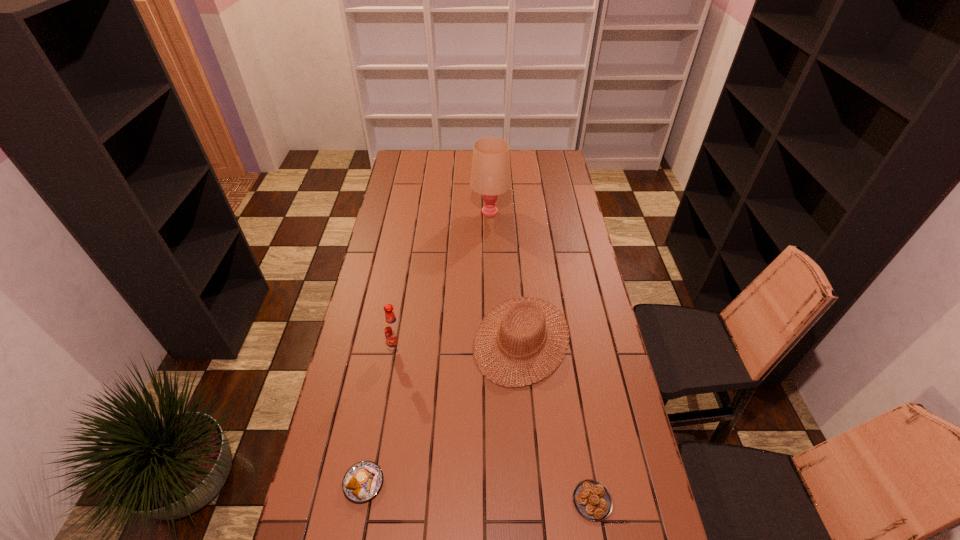
Where is `vacant area that lies between the fourth shortest object and the left pastry`? The image size is (960, 540). vacant area that lies between the fourth shortest object and the left pastry is located at coordinates (380, 416).

This screenshot has width=960, height=540. In order to click on vacant space in between the third tallest object and the right pastry in this screenshot , I will do `click(557, 420)`.

At what (x,y) coordinates should I click in order to perform the action: click on free space between the taller pastry and the third shortest object. Please return your answer as a coordinate pair (x, y). The width and height of the screenshot is (960, 540). Looking at the image, I should click on (443, 411).

Identify the location of vacant area between the left pastry and the tallest object. (427, 347).

Identify the location of free area in between the third tallest object and the root beer. The image size is (960, 540). (460, 344).

Where is `unoccupied area between the farthest object and the sunhat`? Image resolution: width=960 pixels, height=540 pixels. unoccupied area between the farthest object and the sunhat is located at coordinates (506, 275).

Find the location of `vacant space in between the sunhat and the fourth shortest object`. vacant space in between the sunhat and the fourth shortest object is located at coordinates (460, 344).

Identify the location of free space between the fourth tallest object and the shorter pastry. (478, 492).

You are a GUI agent. You are given a task and a screenshot of the screen. Output one action in this format:
    pyautogui.click(x=<x>, y=<y>)
    Task: Click on the blank region between the shorter pastry and the sunhat
    Image resolution: width=960 pixels, height=540 pixels.
    Given the screenshot: What is the action you would take?
    pyautogui.click(x=557, y=420)

Select which object appears as the closest to the fourth tallest object. Please provide its 2D coordinates. Your answer should be formatted as a tuple, i.e. [(x, y)], where the tuple contains the x and y coordinates of a point satisfying the conditions above.

[(537, 311)]